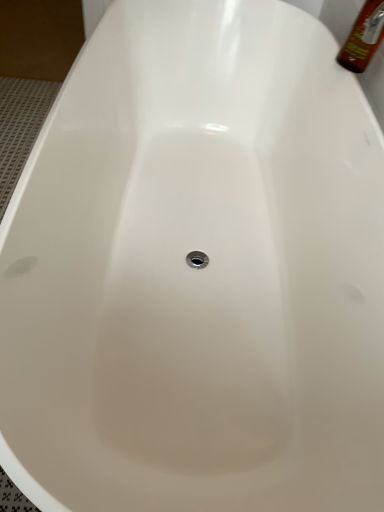
Measure the distance between translucent amber bottle at upper right and camera.

38.74 inches.

Identify the location of translucent amber bottle at upper right. (363, 37).

This screenshot has height=512, width=384. What do you see at coordinates (363, 37) in the screenshot? I see `translucent amber bottle at upper right` at bounding box center [363, 37].

Identify the location of translucent amber bottle at upper right. The width and height of the screenshot is (384, 512). point(363,37).